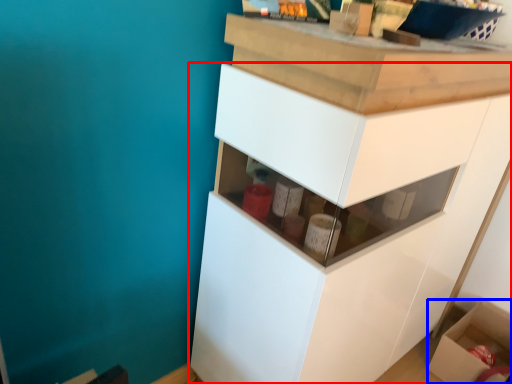
Question: Which point is further to the camera, cabinetry (highlighted by a red box) or cardboard box (highlighted by a blue box)?

Choices:
 (A) cabinetry
 (B) cardboard box

Answer: (B)